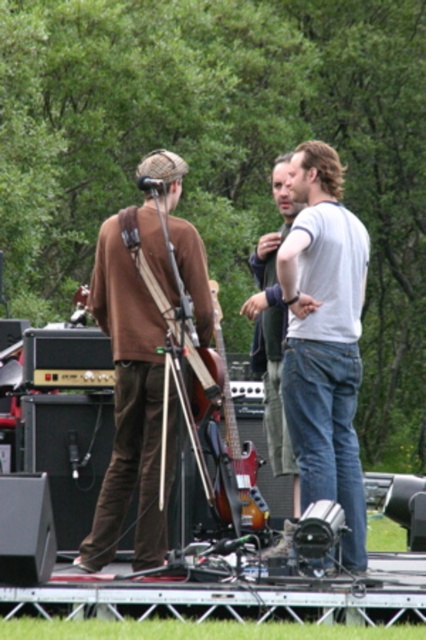
Question: Which point is farther from the camera taking this photo?

Choices:
 (A) (347, 480)
 (B) (118, 452)
 (C) (218, 332)
 (D) (348, 298)

Answer: (C)

Question: Which of the following is the farthest from the observer?

Choices:
 (A) (147, 545)
 (B) (298, 230)
 (C) (247, 492)
 (D) (276, 436)

Answer: (D)

Question: Does brown suede shirt at left lie in front of denim jeans at center?

Choices:
 (A) yes
 (B) no

Answer: (B)

Question: Does brown cotton shirt at center have a larger size compared to brown suede shirt at left?

Choices:
 (A) yes
 (B) no

Answer: (A)

Question: Can you confirm if white cotton t-shirt at center is positioned to the right of denim jeans at center?

Choices:
 (A) no
 (B) yes

Answer: (B)

Question: Which object is closer to the camera taking this photo?

Choices:
 (A) denim jeans at center
 (B) brown suede shirt at left

Answer: (A)